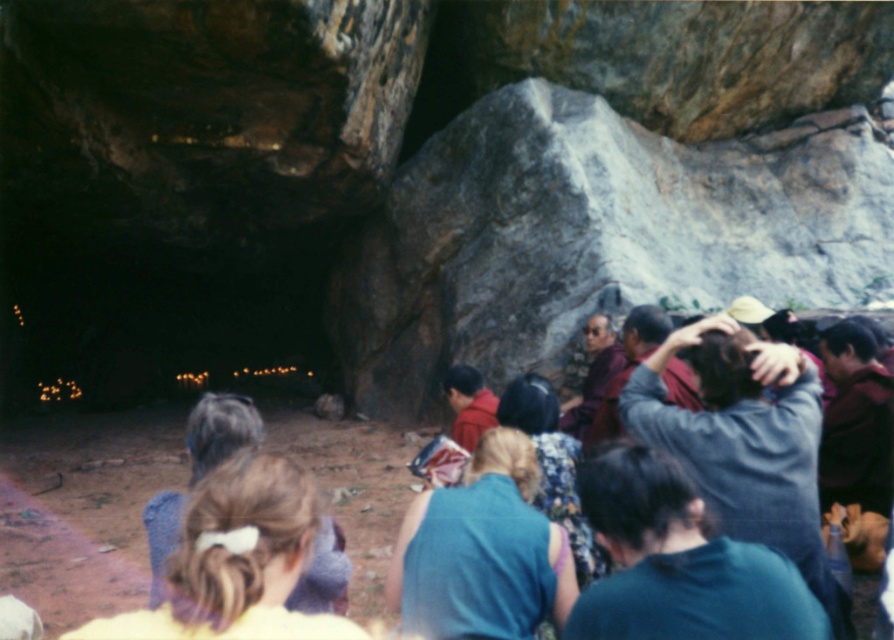
Question: Is teal fabric shirt at lower center above maroon velvet robe at right?

Choices:
 (A) no
 (B) yes

Answer: (A)

Question: Which object is positioned closest to the floral fabric dress at center?

Choices:
 (A) teal fabric shirt at lower center
 (B) maroon velvet robe at right

Answer: (A)

Question: Can you confirm if teal fabric shirt at lower center is positioned to the right of blue fabric dress at center?

Choices:
 (A) no
 (B) yes

Answer: (B)

Question: Which of the following is the farthest from the observer?

Choices:
 (A) purple velvet robe at center
 (B) maroon velvet robe at right
 (C) blue denim jacket at center right
 (D) blue fabric dress at center

Answer: (A)

Question: Which point is farther to the camera?

Choices:
 (A) (277, 554)
 (B) (587, 390)
 (C) (435, 614)

Answer: (B)

Question: Does blonde hair bun at center appear on the left side of floral fabric dress at center?

Choices:
 (A) yes
 (B) no

Answer: (A)